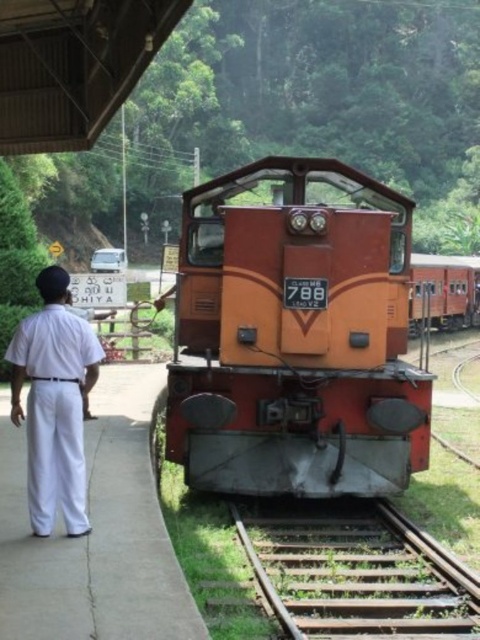
Question: Is green grassy train track at center bigger than orange matte train at center?

Choices:
 (A) yes
 (B) no

Answer: (B)

Question: Which point is farther from the camera taking this photo?

Choices:
 (A) (397, 611)
 (B) (47, 448)
 (C) (470, 275)
 (D) (204, 468)

Answer: (C)

Question: Which object is positioned closest to the rusty metal train at center?

Choices:
 (A) orange matte train at center
 (B) green grassy train track at center
 (C) white cotton uniform at left

Answer: (C)

Question: Can you confirm if rusty metal train at center is positioned below orange matte train at center?

Choices:
 (A) no
 (B) yes

Answer: (B)

Question: Is rusty metal train at center above orange matte train at center?

Choices:
 (A) yes
 (B) no

Answer: (B)

Question: Which point is farther from the camera taking this photo?

Choices:
 (A) (456, 260)
 (B) (254, 524)
 (C) (205, 323)
 (D) (87, 324)

Answer: (A)